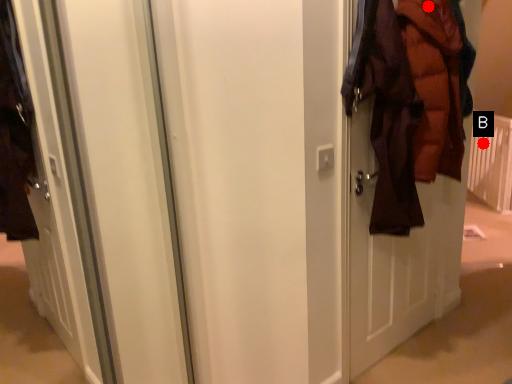
Question: Two points are circled on the image, labeled by A and B beside each circle. Among these points, which one is farthest from the camera?

Choices:
 (A) A is further
 (B) B is further

Answer: (B)